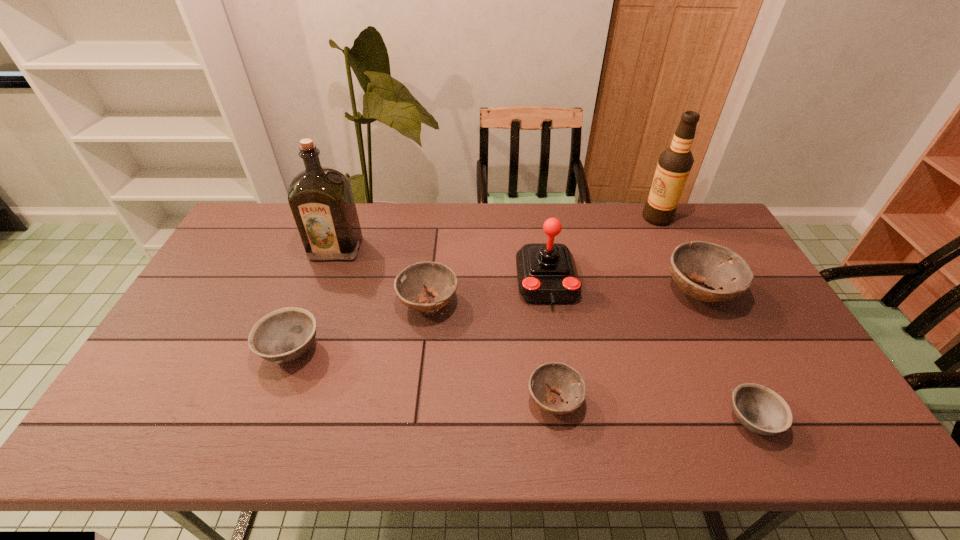
At what (x,y) coordinates should I click in order to perform the action: click on free spot between the smaller gray bowl and the joystick. Please return your answer as a coordinate pair (x, y). Looking at the image, I should click on point(649,351).

Find the location of a particular element. free space between the leftmost bowl and the farthest object is located at coordinates (474, 284).

Where is `object that is the closest to the right gray bowl`? Image resolution: width=960 pixels, height=540 pixels. object that is the closest to the right gray bowl is located at coordinates (716, 266).

Find the location of a particular element. The height and width of the screenshot is (540, 960). object that can be found as the closest to the joystick is located at coordinates (438, 279).

Locate an element on the screen. The image size is (960, 540). the fourth closest bowl to the liquor is located at coordinates (716, 266).

Select which bowl is the fourth closest to the tallest bowl. Please provide its 2D coordinates. Your answer should be formatted as a tuple, i.e. [(x, y)], where the tuple contains the x and y coordinates of a point satisfying the conditions above.

[(283, 335)]

Where is `brown bowl identified as the second closest to the alcohol`? This screenshot has height=540, width=960. brown bowl identified as the second closest to the alcohol is located at coordinates (438, 279).

This screenshot has width=960, height=540. In order to click on brown bowl that stands as the third closest to the farthest object in this screenshot , I will do `click(566, 381)`.

At what (x,y) coordinates should I click in order to perform the action: click on vacant space that satisfies the following two spatial constraints: 1. on the label of the alcohol; 2. on the right side of the rightmost brown bowl. Please return your answer as a coordinate pair (x, y). The height and width of the screenshot is (540, 960). Looking at the image, I should click on (692, 292).

Find the location of `free space that satisfies the following two spatial constraints: 1. on the back side of the tallest bowl; 2. on the label of the farthest object`. free space that satisfies the following two spatial constraints: 1. on the back side of the tallest bowl; 2. on the label of the farthest object is located at coordinates (662, 218).